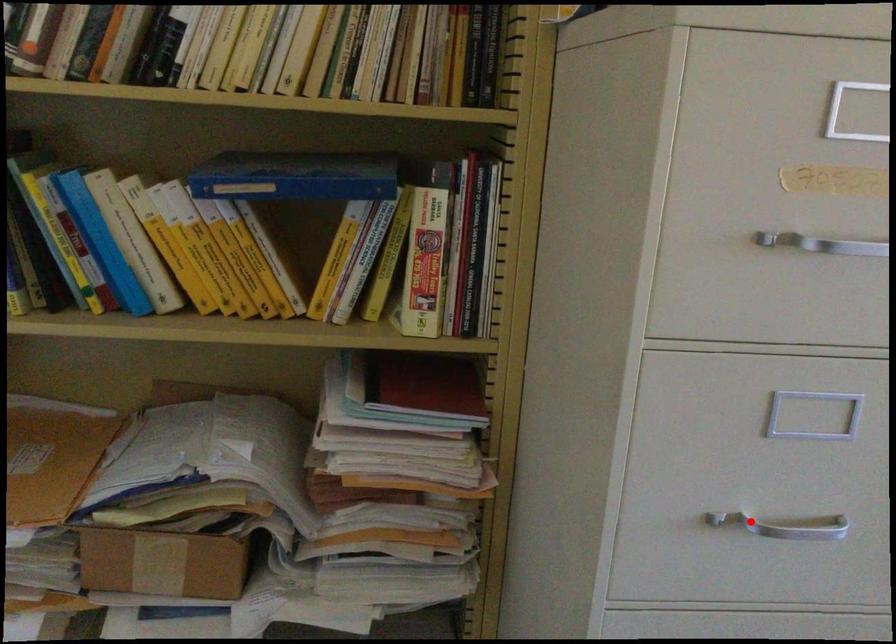
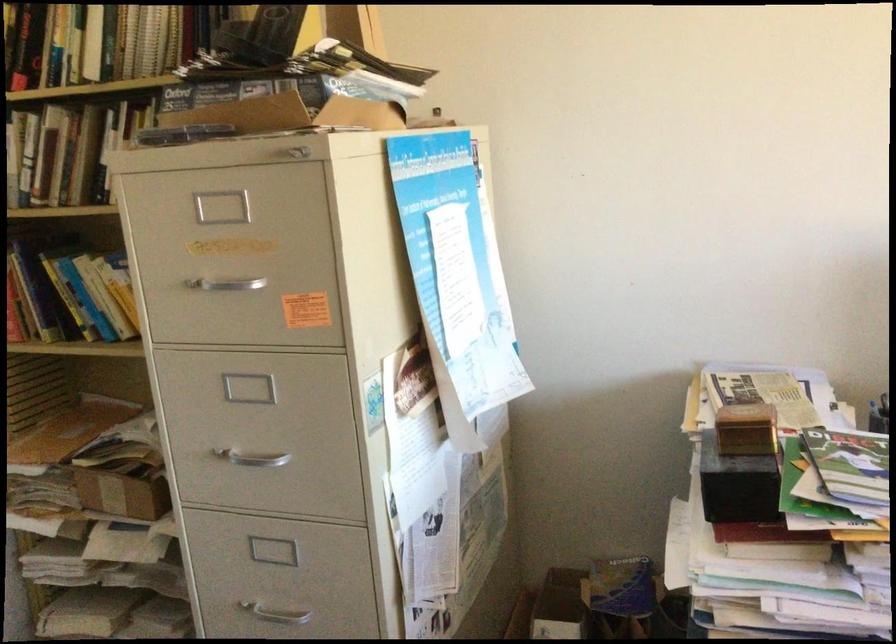
Question: A red point is marked in image1. In image2, is the corresponding 3D point closer to the camera or farther? Reply with the corresponding letter.

Choices:
 (A) The corresponding 3D point is closer.
 (B) The corresponding 3D point is farther.

Answer: (B)